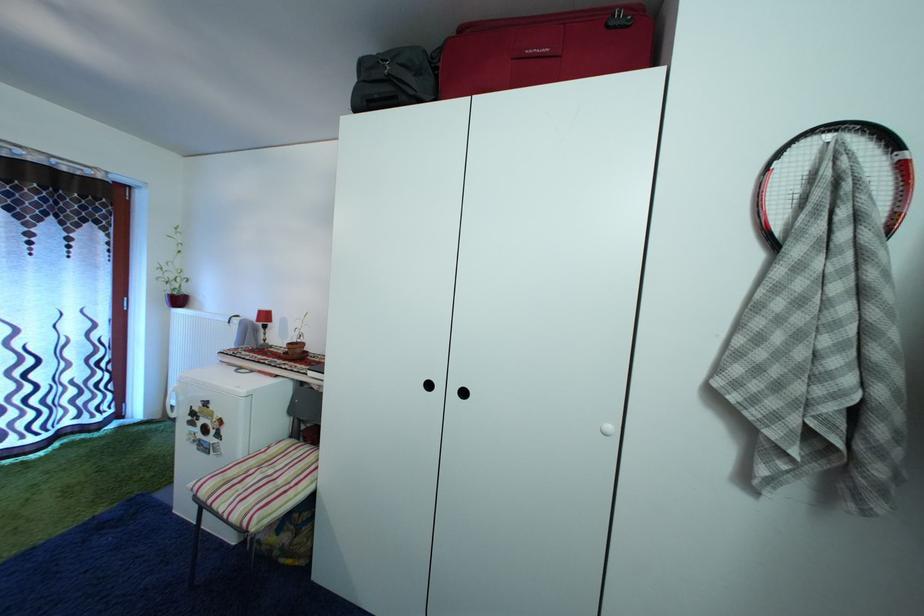
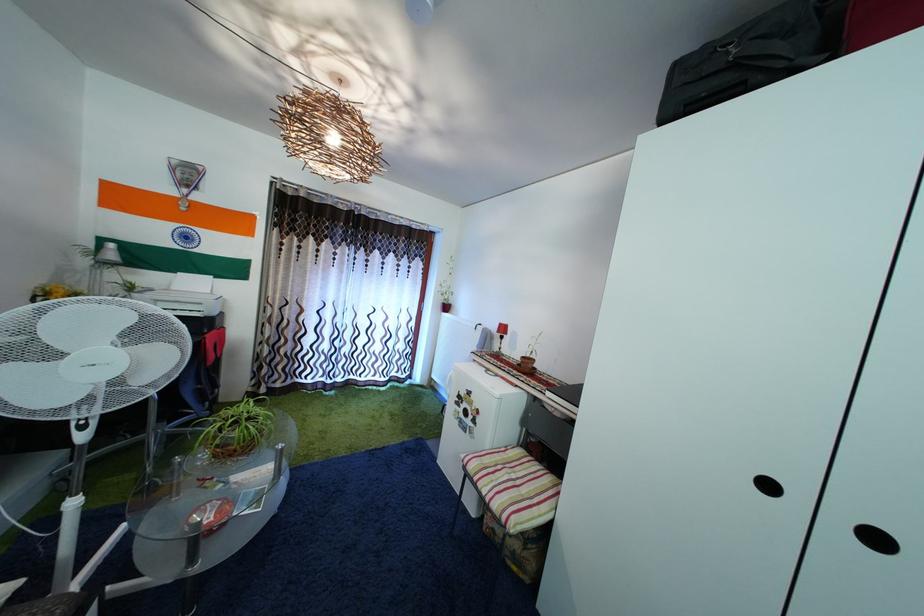
Locate, in the second image, the point that corresponds to point (278, 479) in the first image.

(521, 484)